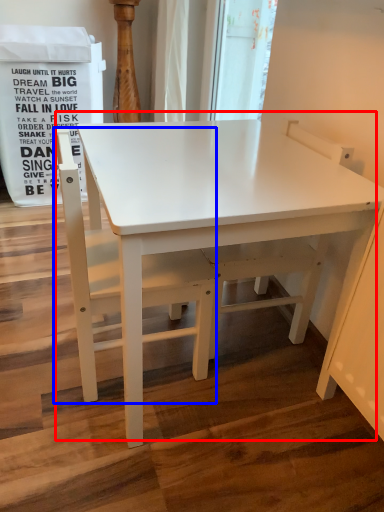
Question: Among these objects, which one is farthest to the camera, table (highlighted by a red box) or chair (highlighted by a blue box)?

Choices:
 (A) table
 (B) chair

Answer: (B)